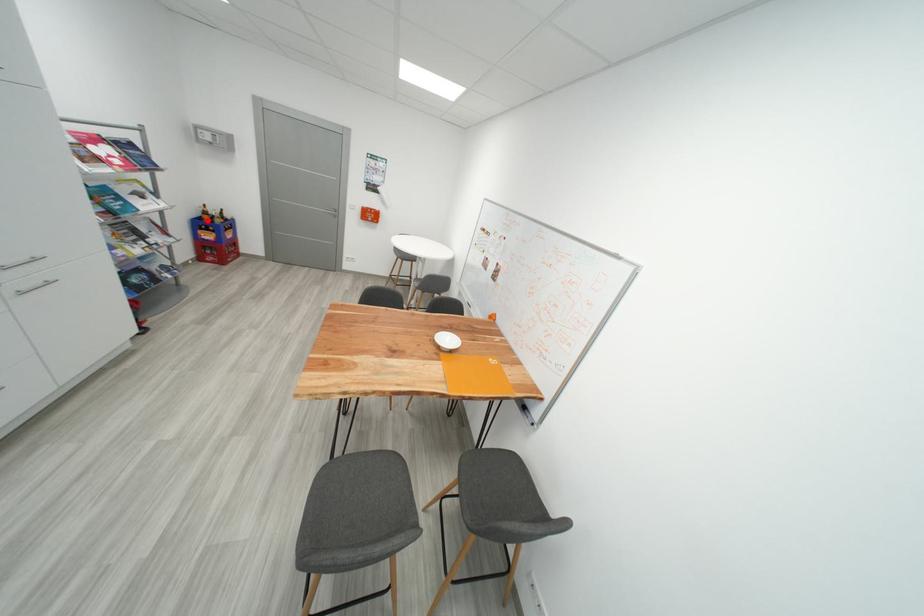
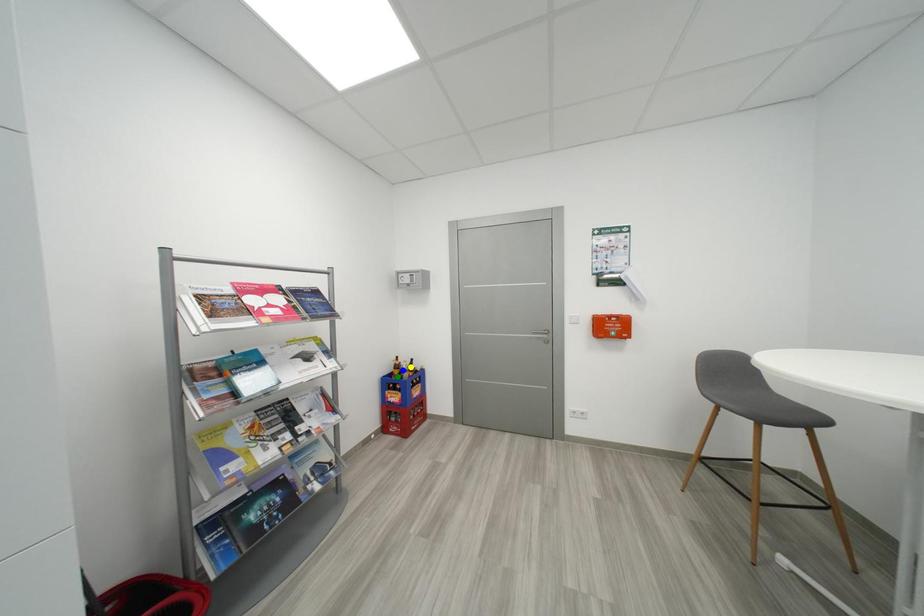
Question: I am providing you with two images of the same scene from different viewpoints. A red point is marked on the first image. You are given multiple points on the second image. Which mark in image 2 goes with the point in image 1?

Choices:
 (A) blue point
 (B) green point
 (C) yellow point

Answer: (B)